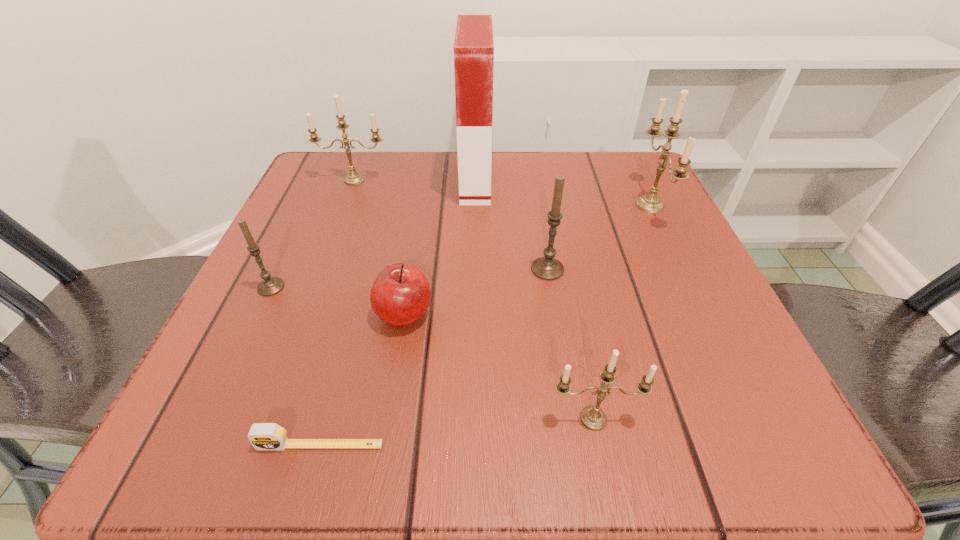
Where is `pink apple`? pink apple is located at coordinates (400, 295).

Where is `the nearest object`? the nearest object is located at coordinates tap(263, 436).

Image resolution: width=960 pixels, height=540 pixels. Find the location of `tape measure`. tape measure is located at coordinates (263, 436).

The height and width of the screenshot is (540, 960). What are the coordinates of `vacant space located on the front-facing side of the tallest object` in the screenshot? It's located at (514, 180).

At what (x,y) coordinates should I click in order to perform the action: click on free location located on the left of the rightmost metallic candle. Please return your answer as a coordinate pair (x, y). Image resolution: width=960 pixels, height=540 pixels. Looking at the image, I should click on (514, 205).

Locate an element on the screen. Image resolution: width=960 pixels, height=540 pixels. vacant space located 0.190m on the back of the right gray candle is located at coordinates (536, 195).

At what (x,y) coordinates should I click in order to perform the action: click on vacant position located 0.140m on the right of the second biggest metallic candle. Please return your answer as a coordinate pair (x, y). This screenshot has height=540, width=960. Looking at the image, I should click on (455, 180).

Find the location of a particular element. vacant space situated on the front of the smaller gray candle is located at coordinates (247, 337).

Image resolution: width=960 pixels, height=540 pixels. Identify the location of blank area located on the left of the second metallic candle from right to left. [x=320, y=418].

This screenshot has height=540, width=960. I want to click on vacant space located on the right of the pink apple, so click(x=627, y=314).